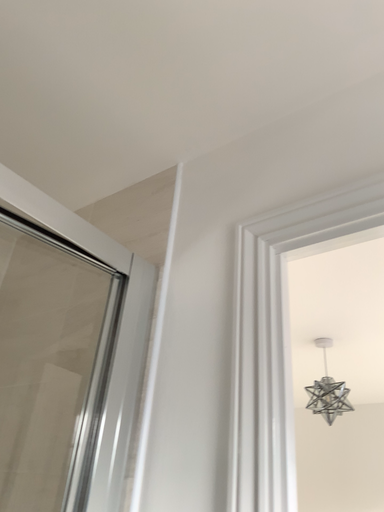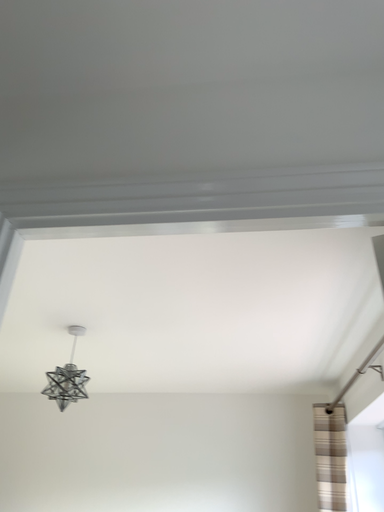
Question: Which way did the camera rotate in the video?

Choices:
 (A) rotated left
 (B) rotated right

Answer: (B)